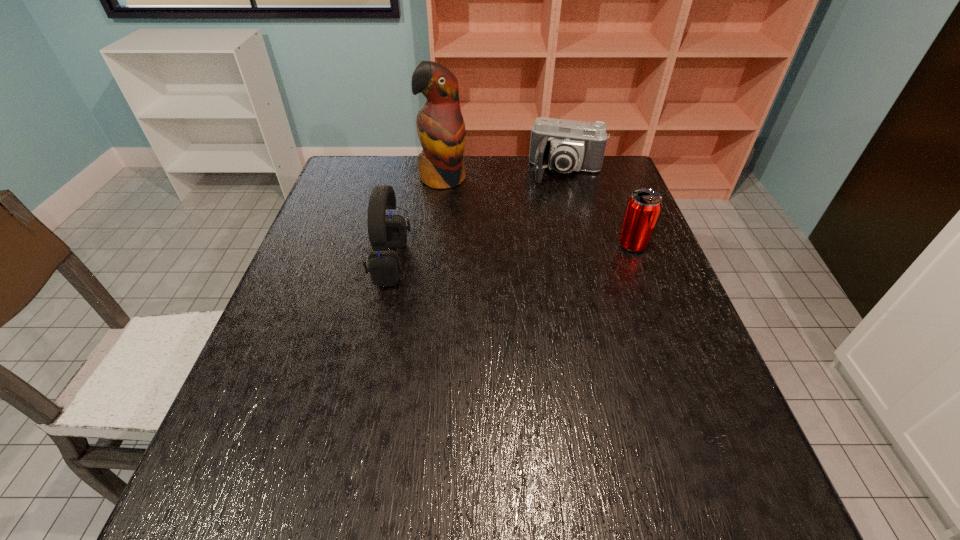
Locate an element on the screen. The width and height of the screenshot is (960, 540). free spot on the desktop that is between the headset and the soda can and is positioned at the front of the camera with an open lens cover is located at coordinates (547, 251).

Identify the location of vacant spot on the desktop that is between the third shortest object and the soda can and is positioned on the face of the parrot. The image size is (960, 540). (480, 256).